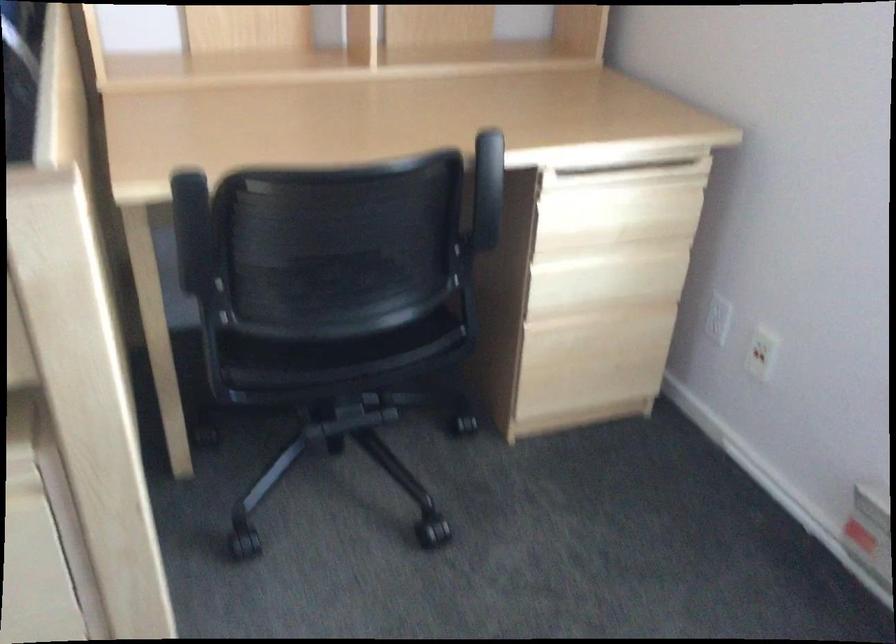
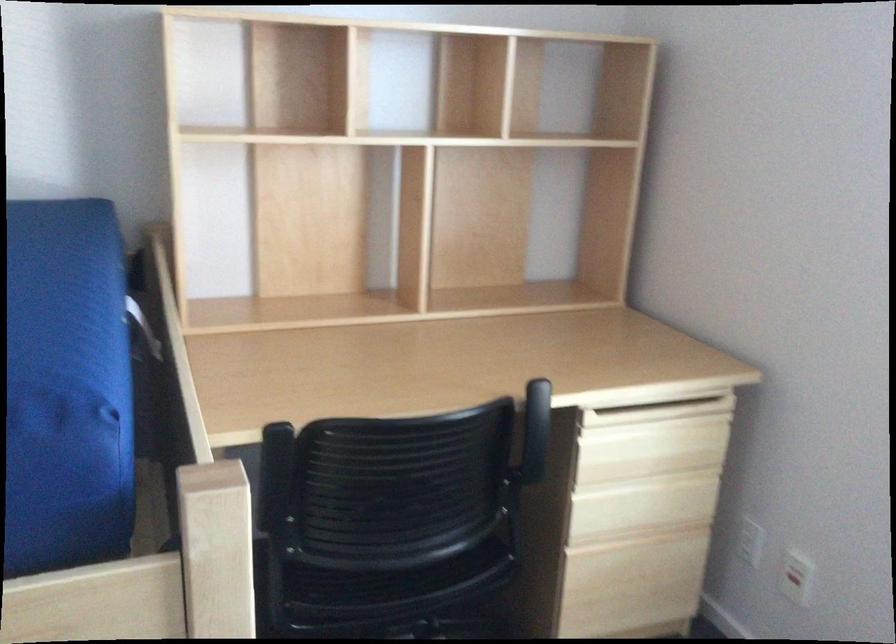
The images are taken continuously from a first-person perspective. In which direction are you moving?

The cameraman moved toward left, backward.